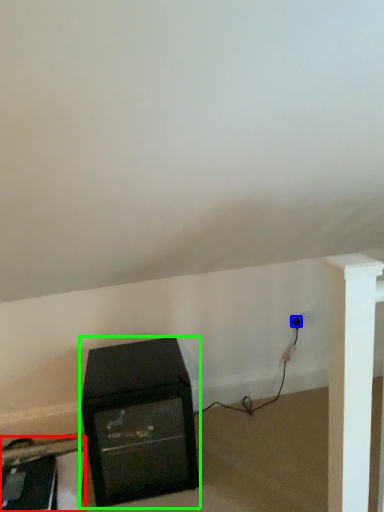
Question: Which object is the farthest from furniture (highlighted by a red box)? Choose among these: plug (highlighted by a blue box) or furniture (highlighted by a green box).

Choices:
 (A) plug
 (B) furniture

Answer: (A)